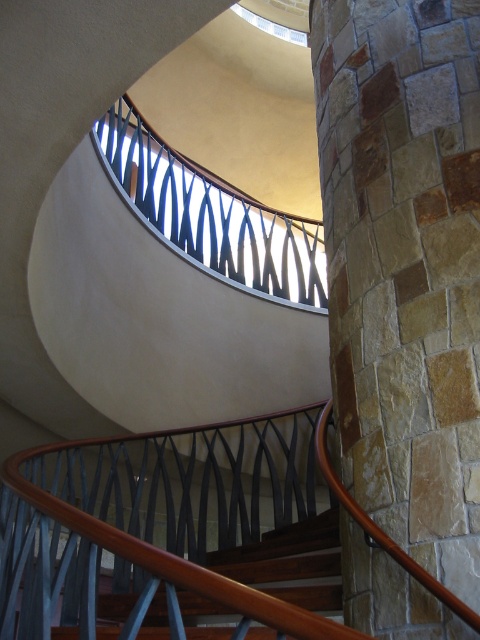
Does natural stone pillar at right appear on the left side of metallic black railing at upper center?

In fact, natural stone pillar at right is to the right of metallic black railing at upper center.

Identify the location of natural stone pillar at right. This screenshot has width=480, height=640. (405, 266).

In order to click on natural stone pillar at right in this screenshot , I will do `click(405, 266)`.